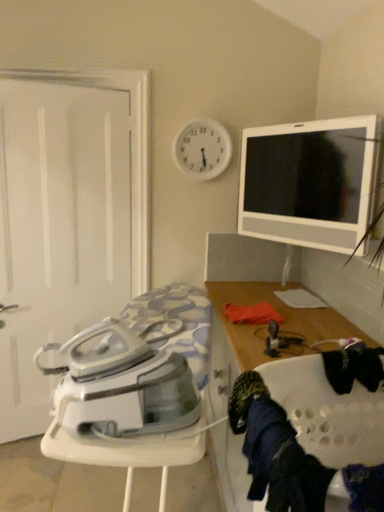
Question: From the image's perspective, is wooden cabinet at right on white glossy tv at upper right?

Choices:
 (A) yes
 (B) no

Answer: (B)

Question: Would you say white glossy tv at upper right is part of wooden cabinet at right's contents?

Choices:
 (A) yes
 (B) no

Answer: (B)

Question: Is wooden cabinet at right not inside white glossy tv at upper right?

Choices:
 (A) yes
 (B) no

Answer: (A)

Question: Is wooden cabinet at right thinner than white glossy tv at upper right?

Choices:
 (A) yes
 (B) no

Answer: (B)

Question: Is wooden cabinet at right bigger than white glossy tv at upper right?

Choices:
 (A) no
 (B) yes

Answer: (B)

Question: From a real-world perspective, is white glossy ironing board at lower left positioned above or below wooden cabinet at right?

Choices:
 (A) below
 (B) above

Answer: (B)

Question: Is point (148, 399) closer or farther from the camera than point (233, 342)?

Choices:
 (A) closer
 (B) farther

Answer: (A)

Question: Relative to wooden cabinet at right, is white glossy ironing board at lower left in front or behind?

Choices:
 (A) behind
 (B) front

Answer: (A)

Question: From the image's perspective, relative to wooden cabinet at right, is white glossy ironing board at lower left above or below?

Choices:
 (A) above
 (B) below

Answer: (A)

Question: Is point (294, 176) closer or farther from the camera than point (13, 224)?

Choices:
 (A) farther
 (B) closer

Answer: (B)

Question: Would you say white glossy tv at upper right is to the left or to the right of white matte door at left in the picture?

Choices:
 (A) right
 (B) left

Answer: (A)

Question: In terms of size, does white glossy tv at upper right appear bigger or smaller than white matte door at left?

Choices:
 (A) big
 (B) small

Answer: (B)

Question: Is white glossy tv at upper right situated inside white matte door at left or outside?

Choices:
 (A) outside
 (B) inside

Answer: (A)

Question: Is point (349, 162) positioned closer to the camera than point (147, 356)?

Choices:
 (A) farther
 (B) closer

Answer: (A)

Question: Would you say white glossy tv at upper right is to the left or to the right of white glossy ironing board at lower left in the picture?

Choices:
 (A) right
 (B) left

Answer: (A)